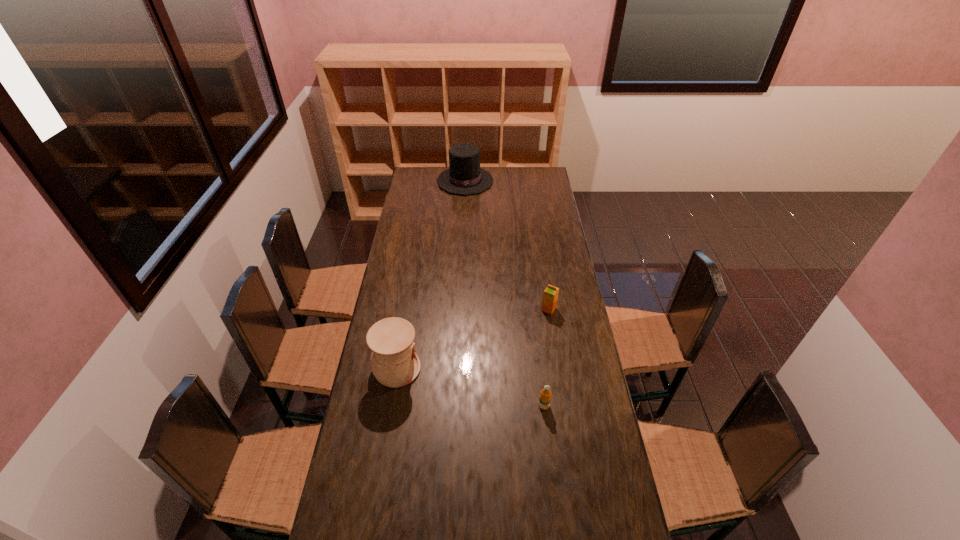
You are a GUI agent. You are given a task and a screenshot of the screen. Output one action in this format:
    pyautogui.click(x=<x>, y=<y>)
    Task: Click on the blank space that satisfies the following two spatial constraints: 1. on the front of the farthest object with the decoration; 2. at the open side of the third farthest object
    This screenshot has height=540, width=960.
    Given the screenshot: What is the action you would take?
    pyautogui.click(x=456, y=369)

Find the location of a particular element. This screenshot has height=540, width=960. free location that satisfies the following two spatial constraints: 1. on the front side of the second shortest object; 2. at the open side of the third farthest object is located at coordinates (558, 369).

This screenshot has height=540, width=960. I want to click on free space that satisfies the following two spatial constraints: 1. on the front side of the farther orange juice; 2. at the open side of the second nearest object, so click(558, 369).